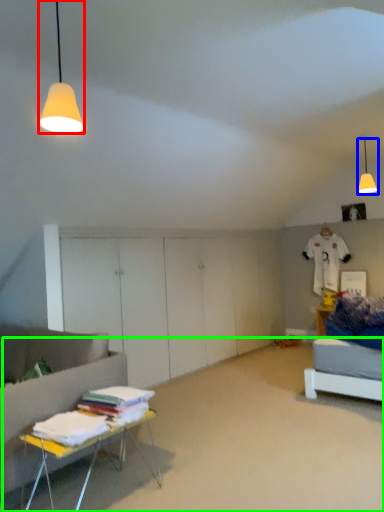
Question: Which object is the farthest from lamp (highlighted by a red box)? Choose among these: lamp (highlighted by a blue box) or plain (highlighted by a green box).

Choices:
 (A) lamp
 (B) plain

Answer: (A)